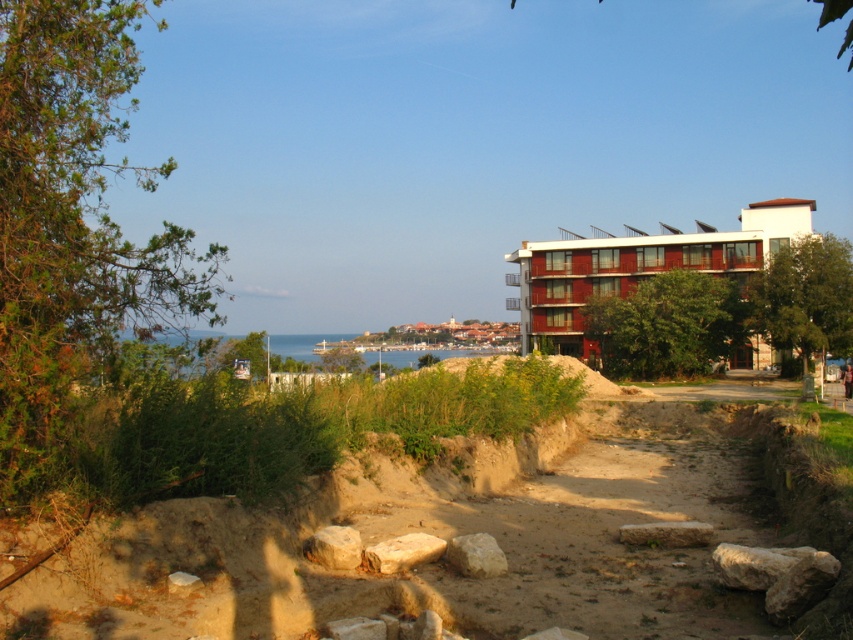
You are standing at the point with coordinates (194, 355) in the coastal scene. What is the immediate environment around you like?

The point at coordinates (194, 355) corresponds to blue water at center, so you are surrounded by blue water at center.

Looking at this image, you are standing at the edge of the sandy area and want to walk to the red wooden building at right. There is a smooth beige rock at center in your path. Which object will you encounter first?

You will encounter the smooth beige rock at center first because the red wooden building at right is further away from you than the smooth beige rock at center.

You are standing at the camera position and want to walk to the blue water at center. Is the distance less than 8 meters?

The blue water at center is 7.98 meters away from camera, so yes, the distance is less than 8 meters.